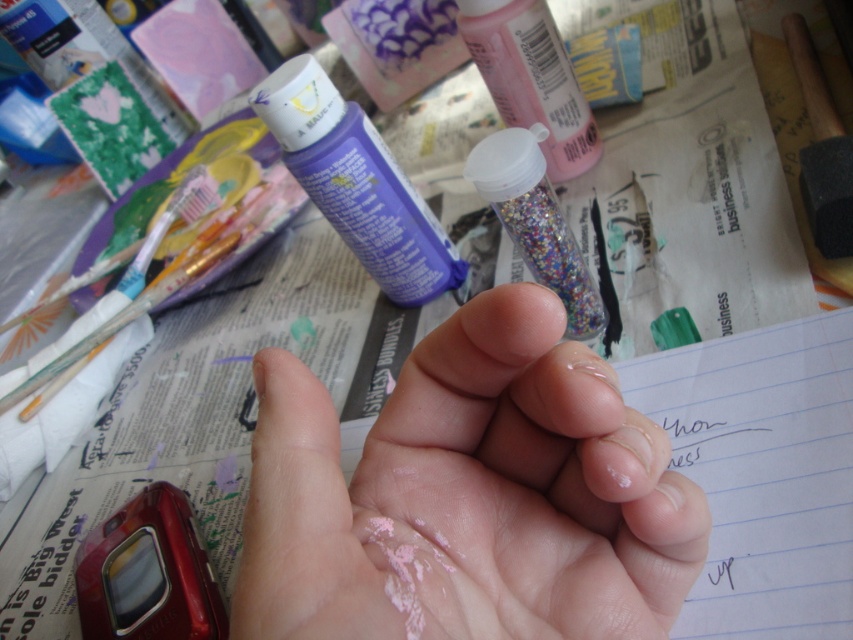
Is pink matte paint at center above shiny plastic glitter container at center?

No, pink matte paint at center is not above shiny plastic glitter container at center.

Is point (466, 538) less distant than point (497, 196)?

That is True.

Identify the location of pink matte paint at center. (467, 496).

Which is in front, point (619, 440) or point (396, 282)?

Point (619, 440)

Does pink matte paint at center have a lesser width compared to purple matte tube at upper center?

No.

Is point (556, 528) more distant than point (392, 296)?

No, it is in front of (392, 296).

Locate an element on the screen. pink matte paint at center is located at coordinates (467, 496).

Can you confirm if purple matte tube at upper center is shorter than shiny plastic glitter container at center?

In fact, purple matte tube at upper center may be taller than shiny plastic glitter container at center.

Between purple matte tube at upper center and shiny plastic glitter container at center, which one has less height?

shiny plastic glitter container at center

Describe the element at coordinates (357, 182) in the screenshot. The width and height of the screenshot is (853, 640). I see `purple matte tube at upper center` at that location.

What are the coordinates of `purple matte tube at upper center` in the screenshot? It's located at (357, 182).